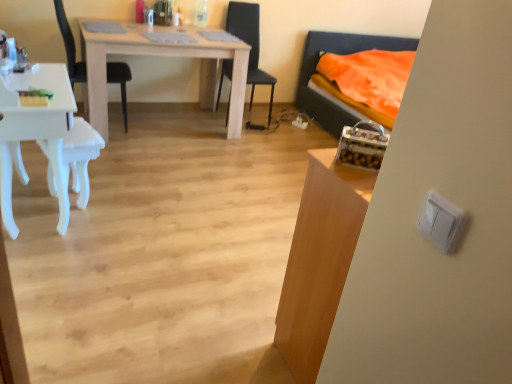
Find the location of a particular element. vacant space in between white glossy armchair at lower left and white glossy switch at right, which ranks as the second table in left-to-right order is located at coordinates (184, 266).